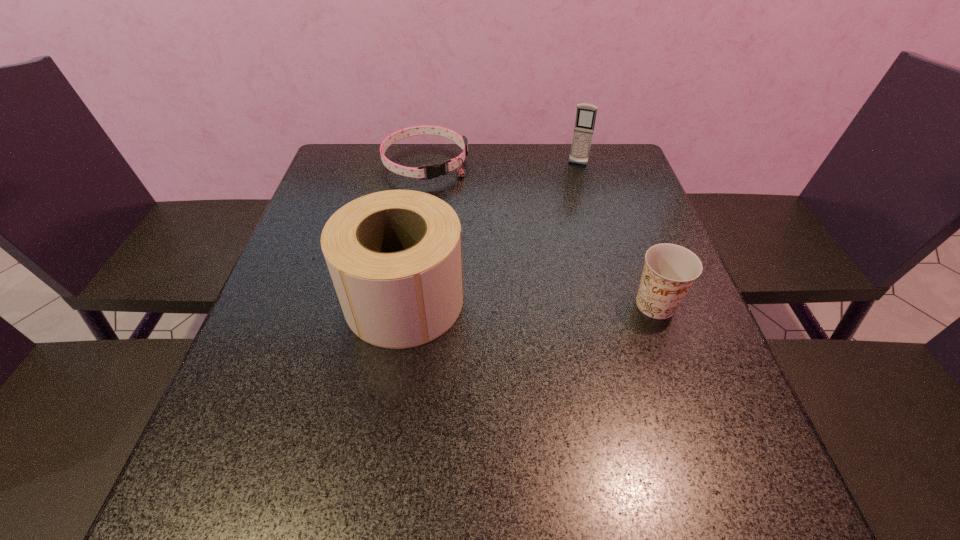
Where is `vacant point located with the buckle on the shortest object`? vacant point located with the buckle on the shortest object is located at coordinates (485, 251).

You are a GUI agent. You are given a task and a screenshot of the screen. Output one action in this format:
    pyautogui.click(x=<x>, y=<y>)
    Task: Click on the free spot located with the buckle on the shortest object
    
    Given the screenshot: What is the action you would take?
    pyautogui.click(x=454, y=206)

Locate an element on the screen. cellular telephone situated at the far edge is located at coordinates (586, 114).

You are a GUI agent. You are given a task and a screenshot of the screen. Output one action in this format:
    pyautogui.click(x=<x>, y=<y>)
    Task: Click on the dog collar located in the far edge section of the desktop
    
    Given the screenshot: What is the action you would take?
    pyautogui.click(x=435, y=170)

I want to click on toilet tissue at the left edge, so click(395, 257).

Image resolution: width=960 pixels, height=540 pixels. I want to click on dog collar that is at the left edge, so click(x=435, y=170).

Image resolution: width=960 pixels, height=540 pixels. In order to click on Dixie cup situated at the right edge in this screenshot , I will do `click(670, 270)`.

Identify the location of cellular telephone that is positioned at the right edge. (586, 114).

Find the location of a particular element. The image size is (960, 540). object positioned at the far left corner is located at coordinates (435, 170).

Find the location of a particular element. The width and height of the screenshot is (960, 540). object at the far right corner is located at coordinates (586, 114).